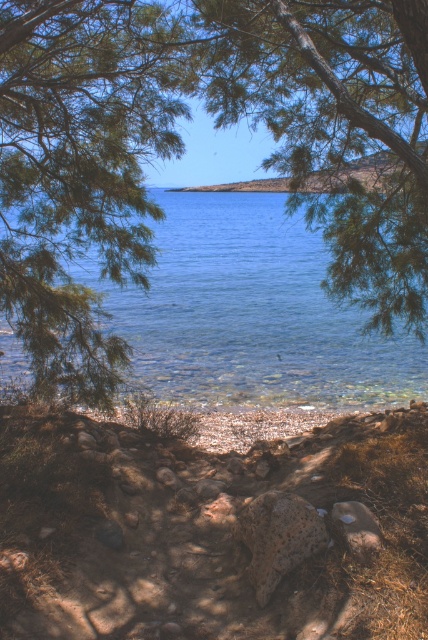
Looking at this image, who is positioned more to the left, clear blue water at center or brown rough stone at center?

A: Positioned to the left is clear blue water at center.

Is point (165, 298) positioned before point (267, 600)?

No, (165, 298) is behind (267, 600).

Describe the element at coordinates (250, 314) in the screenshot. I see `clear blue water at center` at that location.

Locate an element on the screen. The image size is (428, 640). clear blue water at center is located at coordinates (250, 314).

Between clear blue water at center and speckled rock at lower center, which one appears on the right side from the viewer's perspective?

speckled rock at lower center is more to the right.

From the picture: Who is positioned more to the left, clear blue water at center or speckled rock at lower center?

clear blue water at center is more to the left.

Is point (186, 266) positioned before point (362, 508)?

No.

Identify the location of clear blue water at center. The height and width of the screenshot is (640, 428). (250, 314).

Can you confirm if green leafy tree at left is wider than clear blue water at center?

No.

Is green leafy tree at left below clear blue water at center?

Yes, green leafy tree at left is below clear blue water at center.

At what (x,y) coordinates should I click in order to perform the action: click on green leafy tree at left. Please return your answer as a coordinate pair (x, y). Image resolution: width=428 pixels, height=640 pixels. Looking at the image, I should click on (80, 172).

The width and height of the screenshot is (428, 640). What are the coordinates of `green leafy tree at left` in the screenshot? It's located at (80, 172).